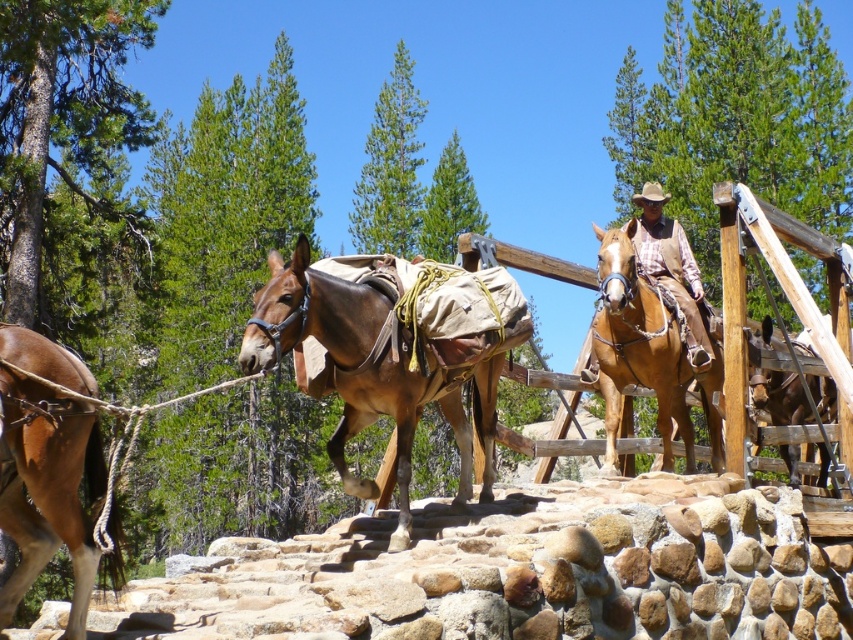
Question: Does brown leather horse at left appear over brown leather saddle at right?

Choices:
 (A) no
 (B) yes

Answer: (A)

Question: Which is farther from the brown leather saddle at right?

Choices:
 (A) brown leather horse at left
 (B) brown leather pack mule at center
 (C) brown leather horse at center

Answer: (A)

Question: From the image, what is the correct spatial relationship of brown leather horse at left in relation to brown leather horse at center?

Choices:
 (A) left
 (B) right

Answer: (A)

Question: Is brown leather pack mule at center bigger than brown leather saddle at right?

Choices:
 (A) yes
 (B) no

Answer: (B)

Question: Which object is farther from the camera taking this photo?

Choices:
 (A) brown leather pack mule at center
 (B) brown leather horse at center
 (C) brown leather horse at left

Answer: (B)

Question: Among these objects, which one is farthest from the camera?

Choices:
 (A) brown leather pack mule at center
 (B) brown leather horse at center
 (C) brown leather horse at left
 (D) brown leather saddle at right

Answer: (D)